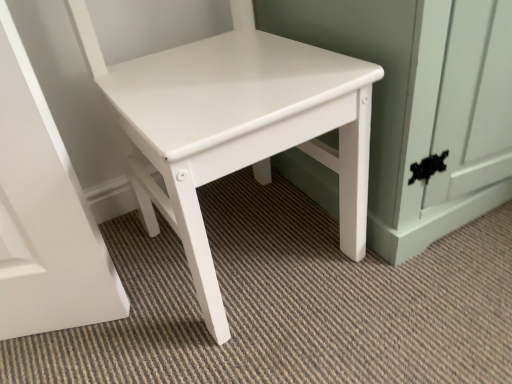
Image resolution: width=512 pixels, height=384 pixels. Identify the location of white matte stool at center. (234, 126).

The height and width of the screenshot is (384, 512). What do you see at coordinates (234, 126) in the screenshot? I see `white matte stool at center` at bounding box center [234, 126].

This screenshot has width=512, height=384. Identify the location of white matte stool at center. (234, 126).